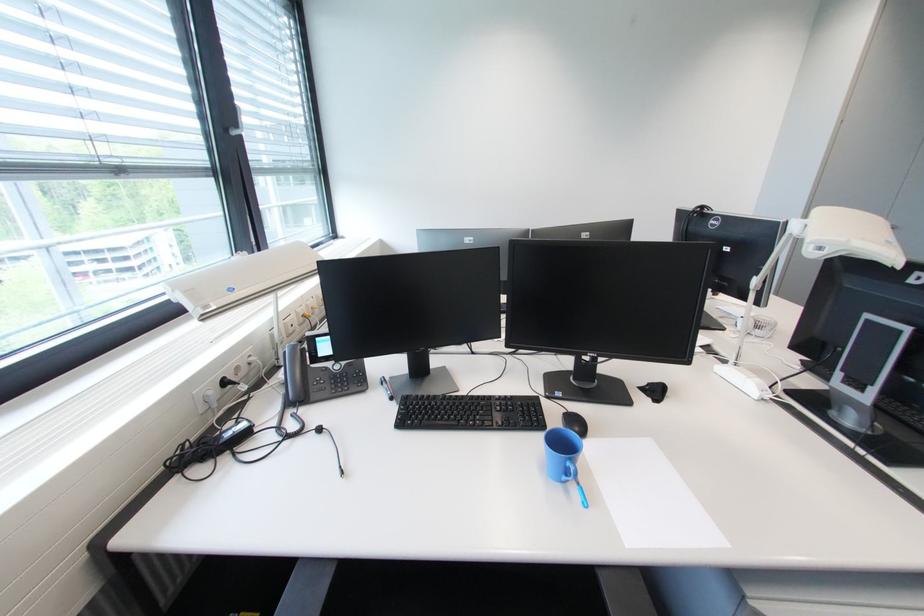
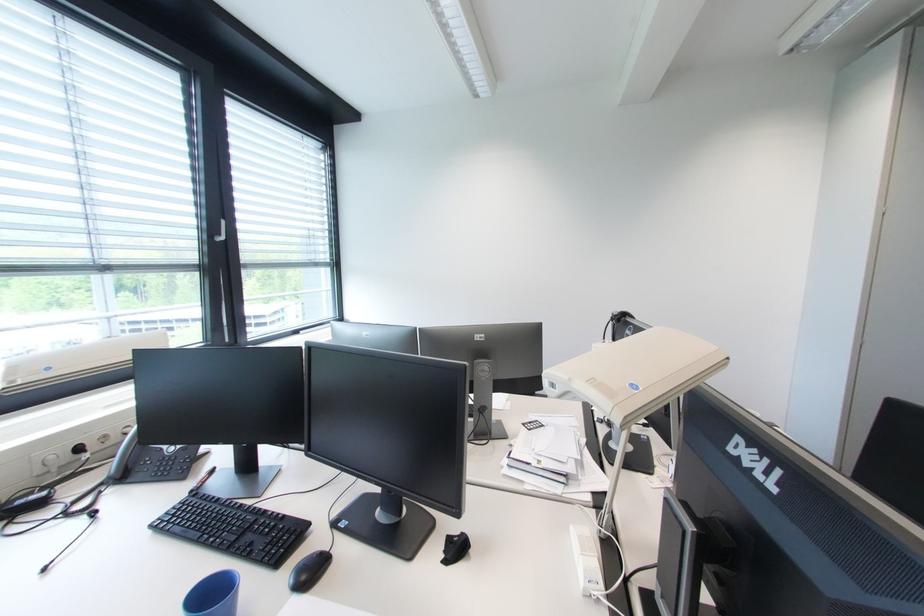
Question: The camera is either moving clockwise (left) or counter-clockwise (right) around the object. The first image is from the beginning of the video and the second image is from the end. Is the camera moving left or right when shooting the video?

Choices:
 (A) Left
 (B) Right

Answer: (B)